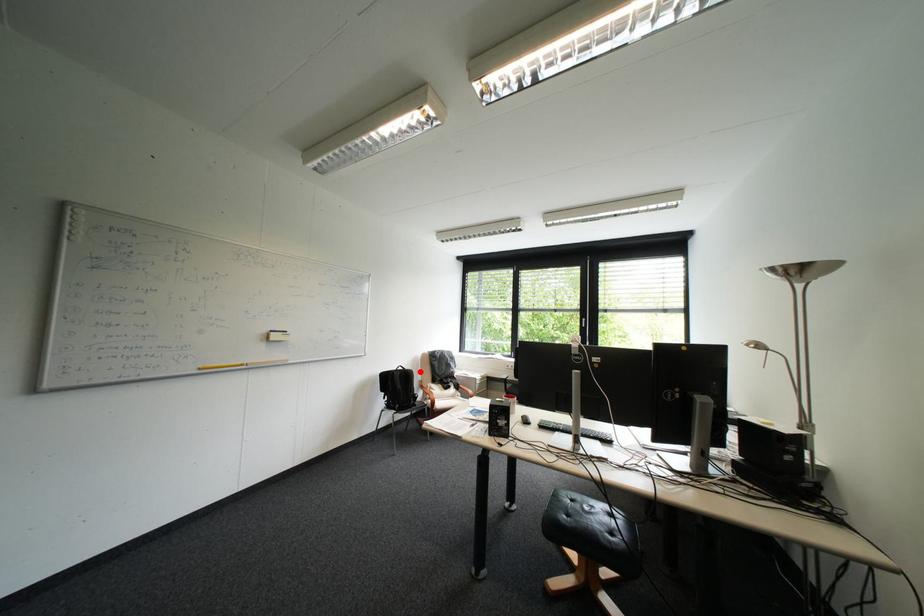
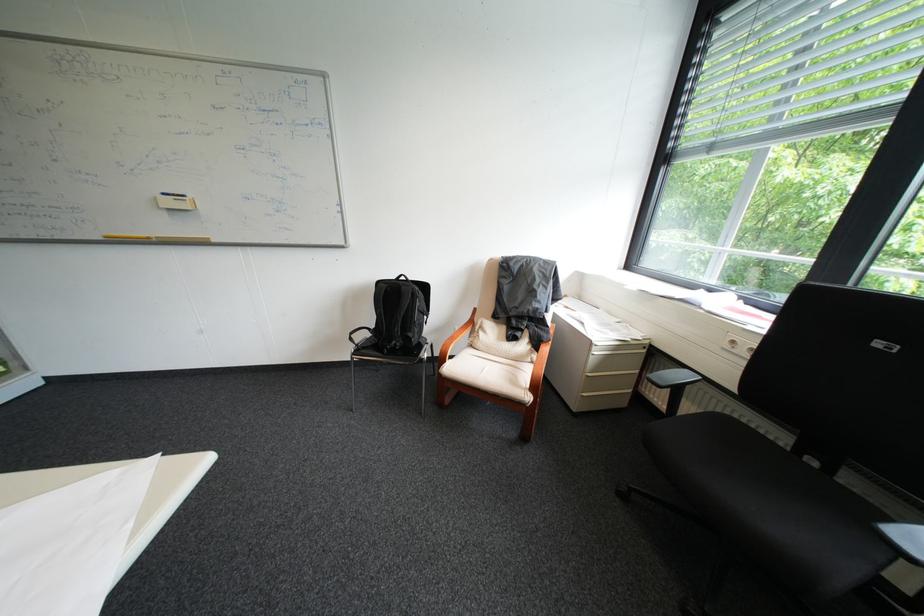
Question: A red point is marked in image1. In image2, is the corresponding 3D point closer to the camera or farther? Reply with the corresponding letter.

Choices:
 (A) The corresponding 3D point is closer.
 (B) The corresponding 3D point is farther.

Answer: (A)